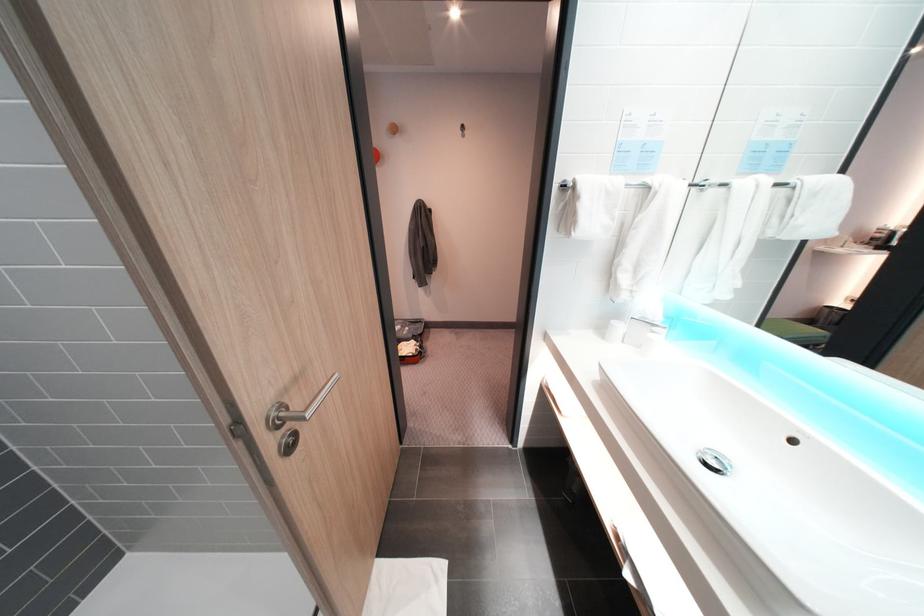
Find where to lift the faucet handle. Please return your answer as a coordinate pair (x, y).

(713, 461)